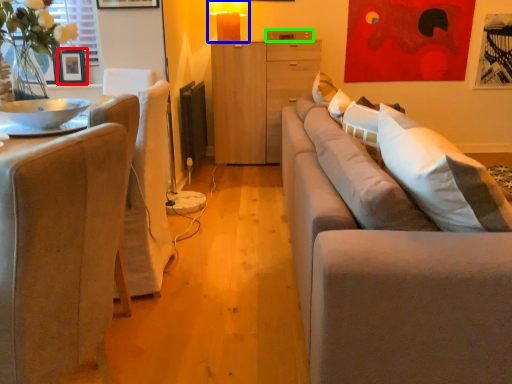
Question: Which object is the closest to the picture frame (highlighted by a red box)? Choose among these: table lamp (highlighted by a blue box) or drawer (highlighted by a green box).

Choices:
 (A) table lamp
 (B) drawer

Answer: (A)